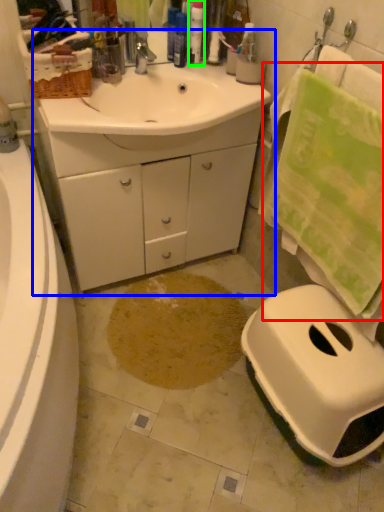
Question: Considering the real-world distances, which object is closest to bath towel (highlighted by a red box)? bathroom cabinet (highlighted by a blue box) or toiletry (highlighted by a green box).

Choices:
 (A) bathroom cabinet
 (B) toiletry

Answer: (A)